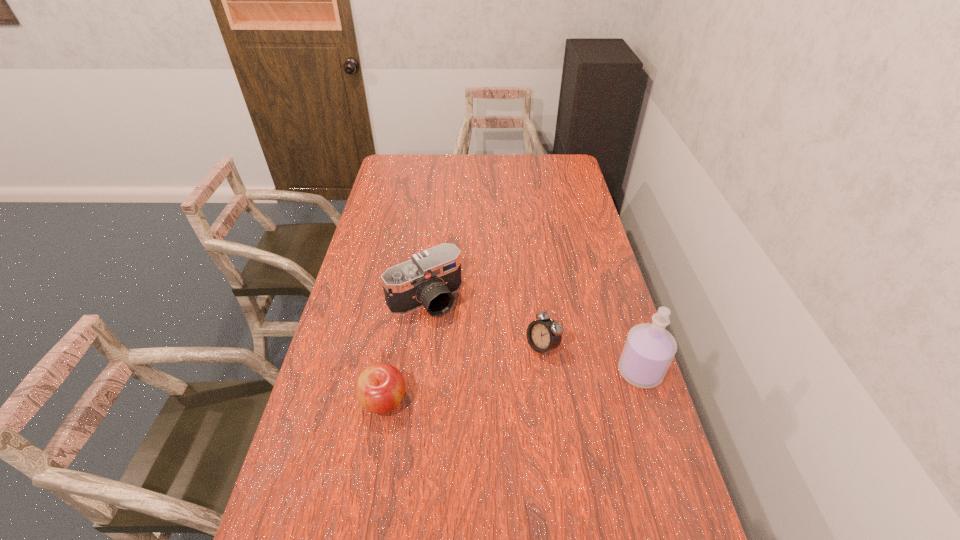
I want to click on free region located on the face of the second object from right to left, so click(x=471, y=394).

Identify the location of free region located on the front-facing side of the second tallest object. The image size is (960, 540). (511, 409).

Find the location of a particular element. This screenshot has width=960, height=540. free spot located 0.360m on the front-facing side of the second tallest object is located at coordinates (506, 403).

This screenshot has height=540, width=960. What are the coordinates of `vacant point located 0.080m on the front-facing side of the second tallest object` in the screenshot? It's located at (455, 336).

In order to click on apple positioned at the left edge in this screenshot , I will do `click(380, 387)`.

What are the coordinates of `camera situated at the left edge` in the screenshot? It's located at (429, 279).

The height and width of the screenshot is (540, 960). What are the coordinates of `object at the right edge` in the screenshot? It's located at (649, 349).

Locate an element on the screen. The width and height of the screenshot is (960, 540). vacant space at the far edge of the desktop is located at coordinates (491, 167).

The image size is (960, 540). In order to click on free spot at the near edge of the desktop in this screenshot , I will do `click(520, 522)`.

What are the coordinates of `free location at the left edge` in the screenshot? It's located at (391, 256).